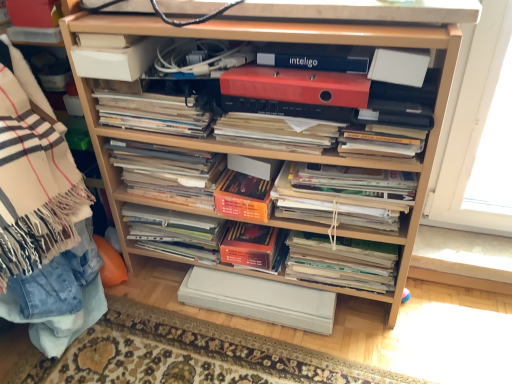
The height and width of the screenshot is (384, 512). In order to click on empty space that is ontop of white paper magazine at center, placed as the first magazine when sorted from top to bottom (from a real-world perspective) in this screenshot , I will do `click(150, 103)`.